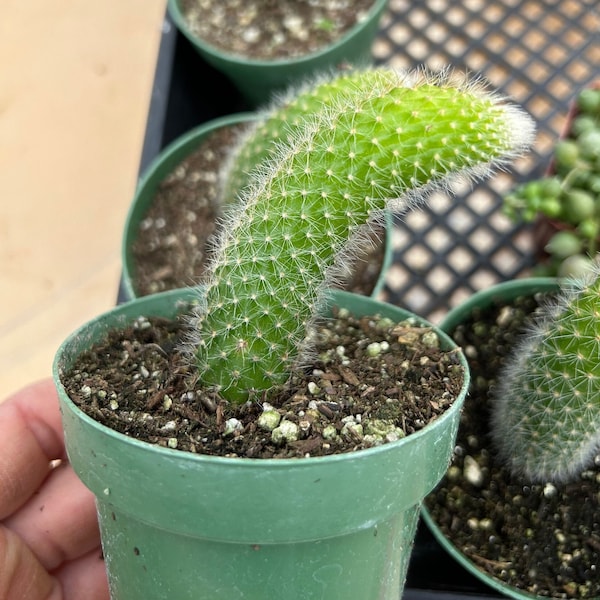
At what (x,y) coordinates should I click in order to perform the action: click on plant. Please return your answer as a coordinate pair (x, y). This screenshot has width=600, height=600. Looking at the image, I should click on (578, 126).